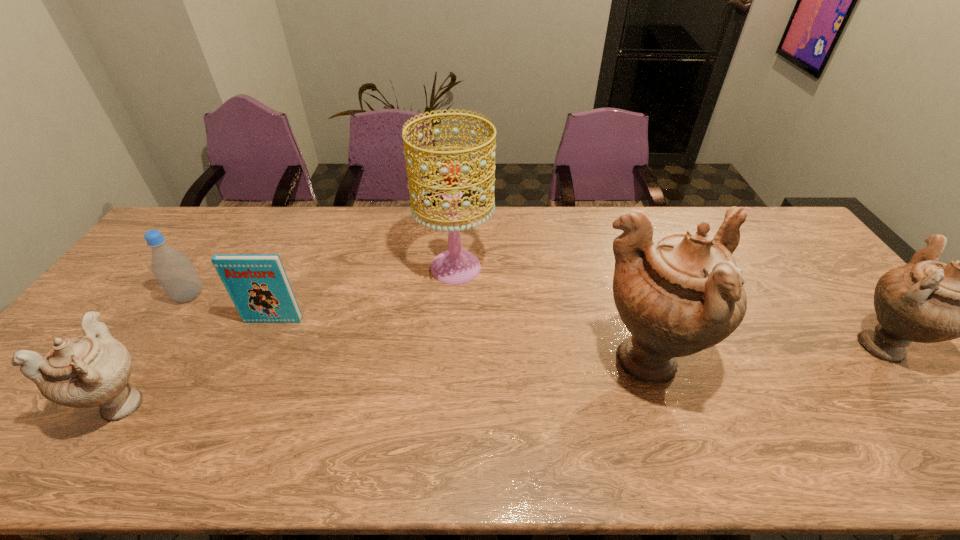
Locate an element on the screen. Image resolution: width=960 pixels, height=540 pixels. the fourth closest object to the rightmost urn is located at coordinates (89, 370).

This screenshot has width=960, height=540. Identify the location of object that stands as the closest to the bottle. (258, 285).

Locate an element on the screen. urn that can be found as the closest to the tallest urn is located at coordinates (926, 301).

Identify which urn is the nearest to the shortest urn. Please provide its 2D coordinates. Your answer should be formatted as a tuple, i.e. [(x, y)], where the tuple contains the x and y coordinates of a point satisfying the conditions above.

[(678, 294)]

Find the location of a particular element. The width and height of the screenshot is (960, 540). free spot that satisfies the following two spatial constraints: 1. on the front side of the lampshade; 2. on the right side of the fourth shortest object is located at coordinates (451, 345).

The width and height of the screenshot is (960, 540). Identify the location of vacant space that satisfies the following two spatial constraints: 1. on the front cover of the rightmost urn; 2. on the left side of the book. (263, 345).